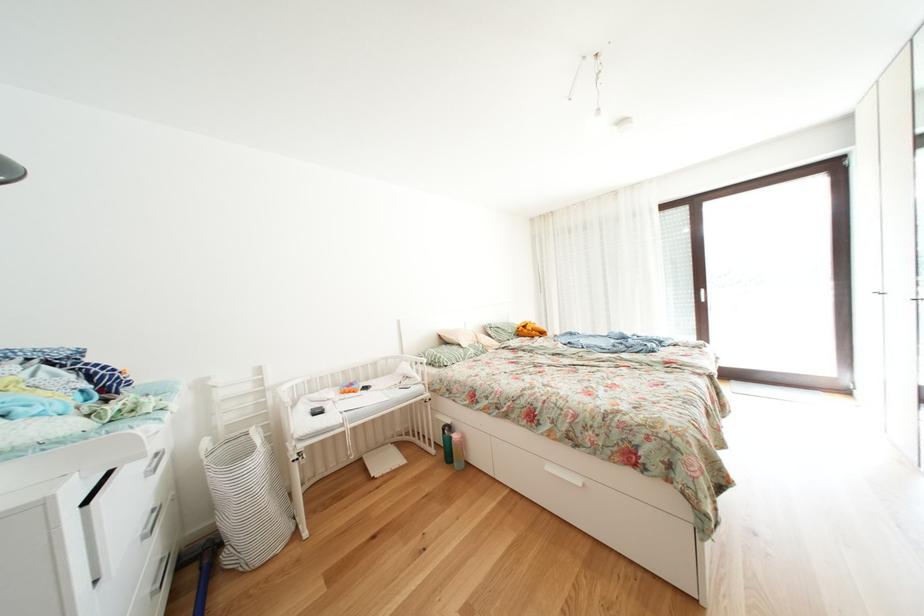
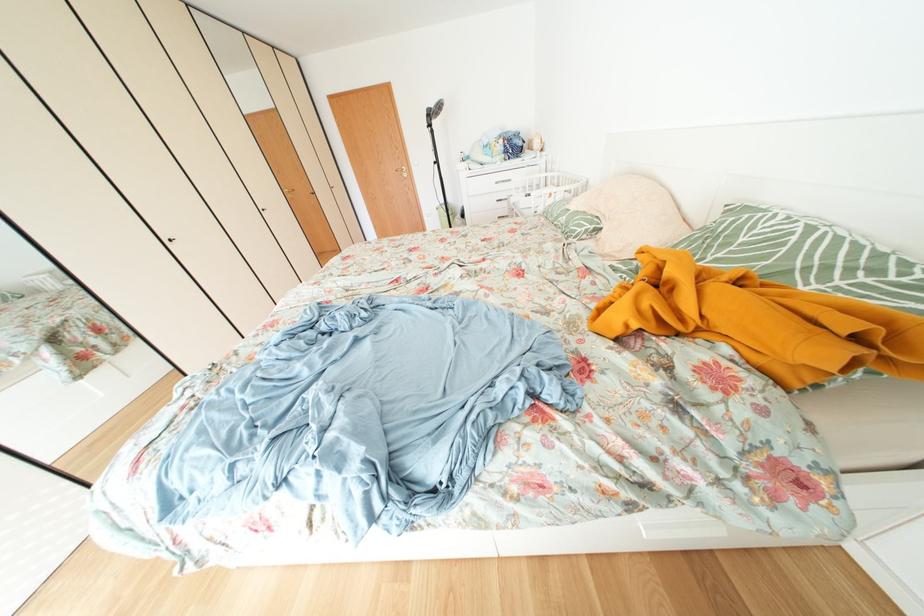
Question: I am providing you with two images of the same scene from different viewpoints. Please identify which objects are invisible in image2.

Choices:
 (A) green patterned pillow
 (B) orange rolled blanket
 (C) wooden door handle
 (D) pink water bottle

Answer: (D)